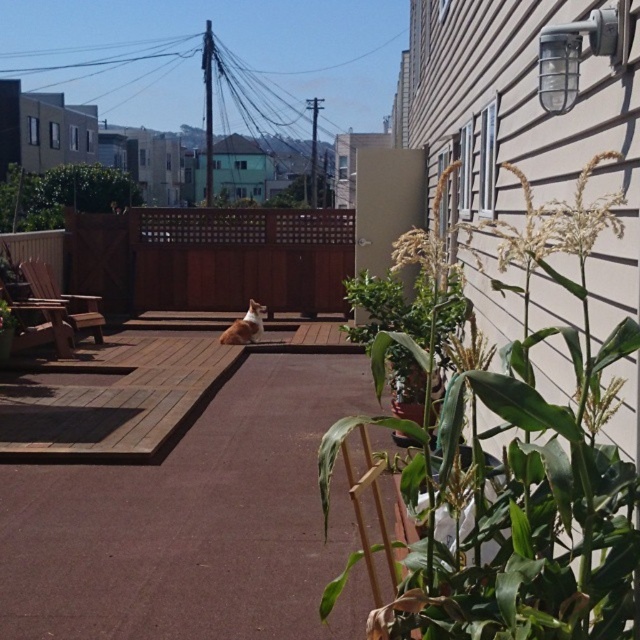
Question: Does green leafy plant at right have a greater width compared to white fur cat at center?

Choices:
 (A) yes
 (B) no

Answer: (A)

Question: Is green leafy plant at upper left positioned at the back of white fur cat at center?

Choices:
 (A) no
 (B) yes

Answer: (B)

Question: Can you confirm if green leafy plant at right is thinner than green leafy plant at upper left?

Choices:
 (A) yes
 (B) no

Answer: (A)

Question: Among these points, which one is farthest from the camera?

Choices:
 (A) tap(12, 198)
 (B) tap(259, 317)
 (C) tap(376, 496)

Answer: (A)

Question: Which object is positioned closest to the green leafy plant at upper left?

Choices:
 (A) green leafy plant at right
 (B) white fur cat at center

Answer: (B)

Question: Among these points, which one is farthest from the camera?

Choices:
 (A) (262, 305)
 (B) (378, 362)

Answer: (A)